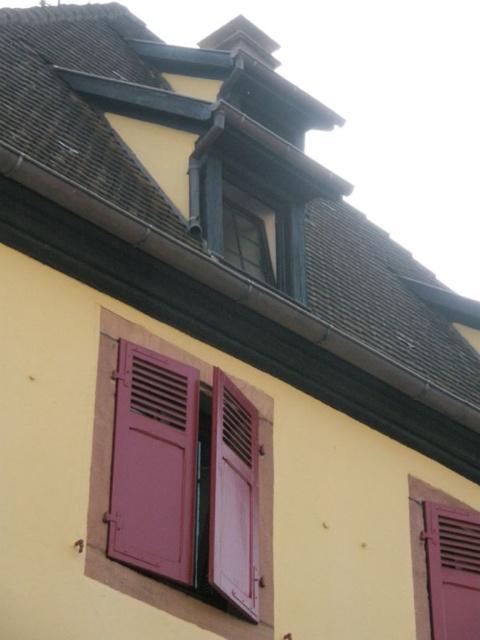
You are standing in front of the building and notice the matte glass window at upper center and the pink matte shutter at lower right. Which object is positioned more to the left side of the building?

The matte glass window at upper center is positioned more to the left side of the building compared to the pink matte shutter at lower right.

You are an architect designing a new building inspired by this traditional style. You need to ensure that the matte pink shutters at lower left and the matte glass window at upper center maintain their proportional relationship. Which object should be placed higher in your design?

The matte glass window at upper center should be placed higher since it is taller than the matte pink shutters at lower left, maintaining their proportional relationship.

You are a painter standing at the base of the building and need to paint both the matte pink wood at center and the pink matte shutter at lower right. You have a ladder that can reach up to 20 feet. Can you safely reach both objects with your current ladder without moving it?

The matte pink wood at center and pink matte shutter at lower right are 24.30 feet apart. Since the ladder can only reach up to 20 feet, you cannot safely reach both objects without moving the ladder because the distance between them exceeds the ladder height limit.